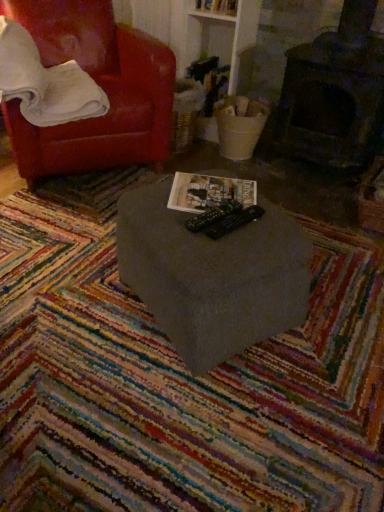
You are a GUI agent. You are given a task and a screenshot of the screen. Output one action in this format:
    pyautogui.click(x=<x>, y=<y>)
    Task: Click on the free space in front of matte paper magazine at center
    This screenshot has height=512, width=384.
    Given the screenshot: What is the action you would take?
    pyautogui.click(x=214, y=240)